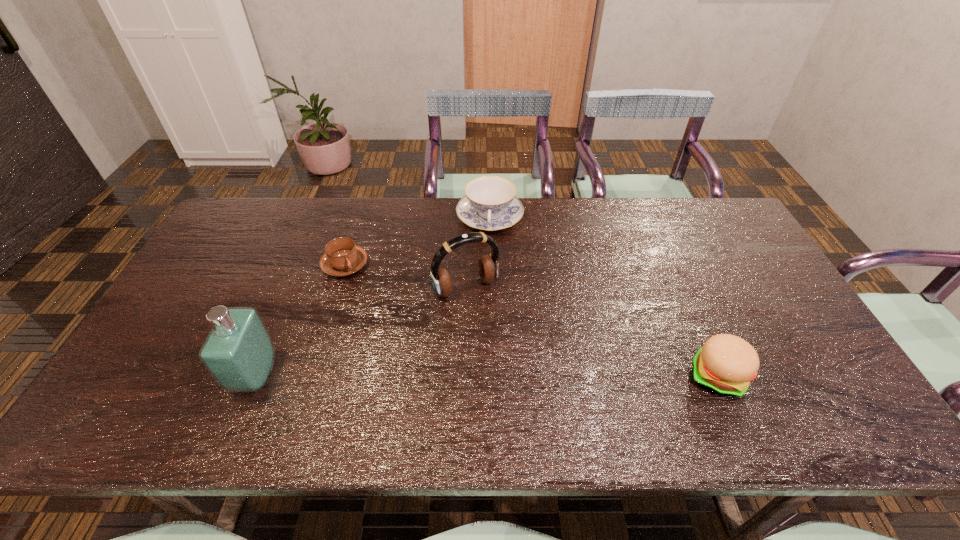
You are a GUI agent. You are given a task and a screenshot of the screen. Output one action in this format:
    pyautogui.click(x=<x>, y=<y>)
    Task: Click on the free space located on the right of the rightmost object
    
    Given the screenshot: What is the action you would take?
    pyautogui.click(x=805, y=376)

Where is `vacant space located on the ear cup of the second tallest object`? The width and height of the screenshot is (960, 540). vacant space located on the ear cup of the second tallest object is located at coordinates (517, 367).

In order to click on free region located 0.300m on the ear cup of the second tallest object in this screenshot , I will do `click(531, 389)`.

The image size is (960, 540). I want to click on free spot located on the ear cup of the second tallest object, so click(492, 323).

The height and width of the screenshot is (540, 960). I want to click on free space located on the side of the shortest object with the handle, so click(x=382, y=287).

I want to click on vacant space located 0.260m on the side of the shortest object with the handle, so click(x=426, y=314).

Image resolution: width=960 pixels, height=540 pixels. Identify the location of vacant region located 0.200m on the side of the shortest object with the handle. (410, 305).

You are a GUI agent. You are given a task and a screenshot of the screen. Output one action in this format:
    pyautogui.click(x=<x>, y=<y>)
    Task: Click on the free spot located with the handle on the side of the farthest object
    
    Given the screenshot: What is the action you would take?
    pyautogui.click(x=492, y=294)

Identify the location of free space located 0.080m with the handle on the side of the farthest object. This screenshot has height=540, width=960. (492, 256).

Locate an element on the screen. The image size is (960, 540). free location located with the handle on the side of the farthest object is located at coordinates (492, 256).